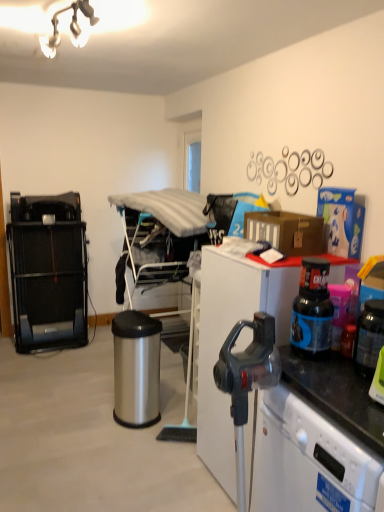
Question: Considering the relative positions of polished stainless steel trash can at center and white matte desk at right in the image provided, is polished stainless steel trash can at center in front of white matte desk at right?

Choices:
 (A) yes
 (B) no

Answer: (B)

Question: Are polished stainless steel trash can at center and white matte desk at right far apart?

Choices:
 (A) no
 (B) yes

Answer: (A)

Question: Can you confirm if polished stainless steel trash can at center is wider than white matte desk at right?

Choices:
 (A) yes
 (B) no

Answer: (B)

Question: Is polished stainless steel trash can at center facing away from white matte desk at right?

Choices:
 (A) no
 (B) yes

Answer: (A)

Question: Is polished stainless steel trash can at center at the left side of white matte desk at right?

Choices:
 (A) no
 (B) yes

Answer: (B)

Question: From a real-world perspective, is polished stainless steel trash can at center below white matte desk at right?

Choices:
 (A) no
 (B) yes

Answer: (B)

Question: Is translucent plastic bottle at right not close to polished stainless steel trash can at center?

Choices:
 (A) no
 (B) yes

Answer: (B)

Question: Considering the relative sizes of translucent plastic bottle at right and polished stainless steel trash can at center in the image provided, is translucent plastic bottle at right shorter than polished stainless steel trash can at center?

Choices:
 (A) no
 (B) yes

Answer: (B)

Question: Is translucent plastic bottle at right oriented towards polished stainless steel trash can at center?

Choices:
 (A) no
 (B) yes

Answer: (A)

Question: Does translucent plastic bottle at right have a lesser width compared to polished stainless steel trash can at center?

Choices:
 (A) no
 (B) yes

Answer: (B)

Question: Is translucent plastic bottle at right next to polished stainless steel trash can at center and touching it?

Choices:
 (A) yes
 (B) no

Answer: (B)

Question: Is translucent plastic bottle at right oriented away from polished stainless steel trash can at center?

Choices:
 (A) yes
 (B) no

Answer: (B)

Question: Is black metal treadmill at left bigger than black plastic bottle at right?

Choices:
 (A) yes
 (B) no

Answer: (A)